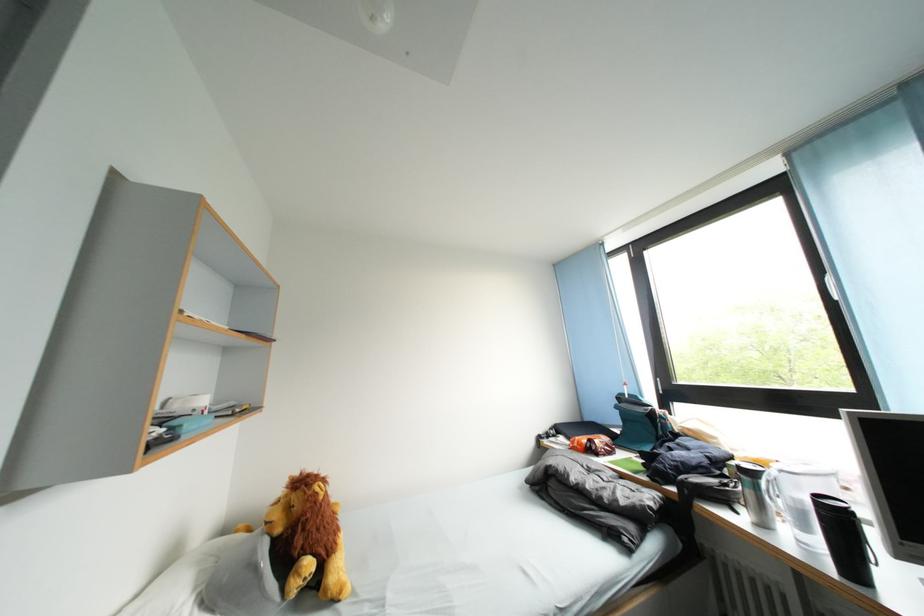
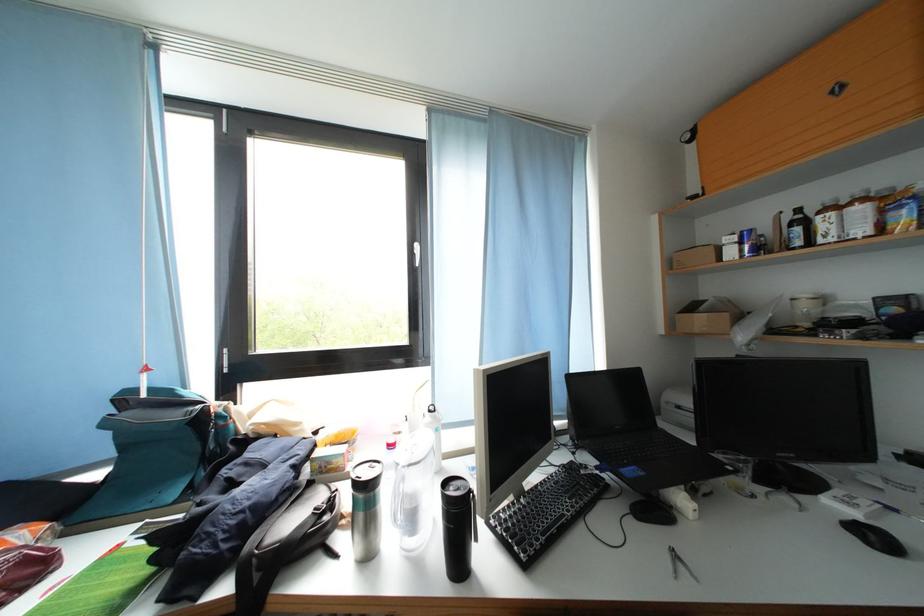
Locate, in the second image, the point that corresponds to the point at 624,411 in the first image.

(114, 429)